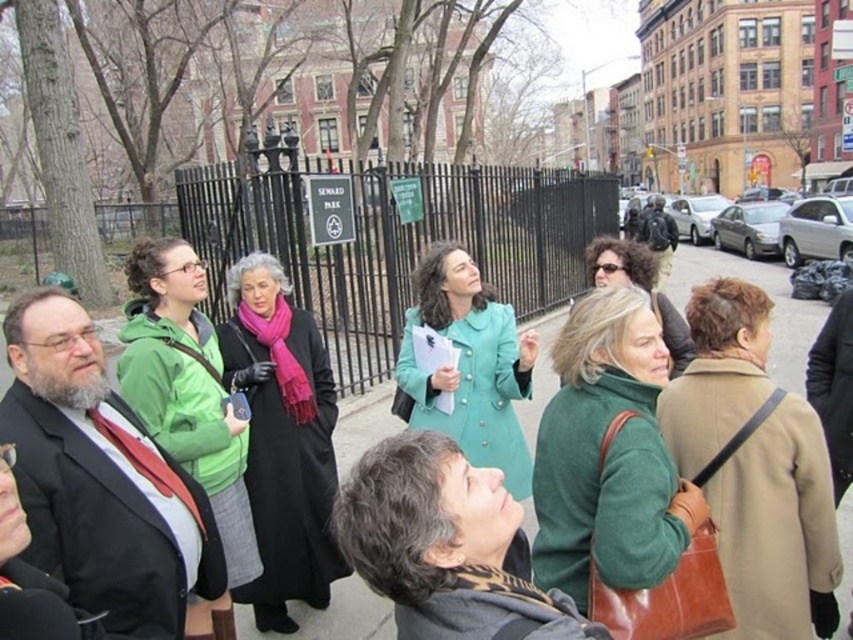
You are part of a tour group in Seward Park and notice two people in winter clothing. The first person wears a brown leather coat at center, and the second wears a green matte jacket at center. From your perspective, which person is standing to the right of the other?

The brown leather coat at center is to the right of the green matte jacket at center, so the person in the brown leather coat at center is standing to the right of the person in the green matte jacket at center.

You are a photographer trying to capture a group photo of the matte black coat at center and the teal fabric coat at center. Since you want both coats to appear equally sized in the photo, which coat should you move closer to the camera and why?

You should move the matte black coat at center closer to the camera because its width is smaller than the teal fabric coat at center, so bringing it nearer will make them appear similar in size.

You are a delivery person standing on the pavement at center. You need to hand a package to the person wearing the green matte sweater at center. Can you reach them without moving from your current position?

The distance between the green matte sweater at center and the pavement at center is 17.01 feet, so you cannot reach them without moving since the distance is too far.